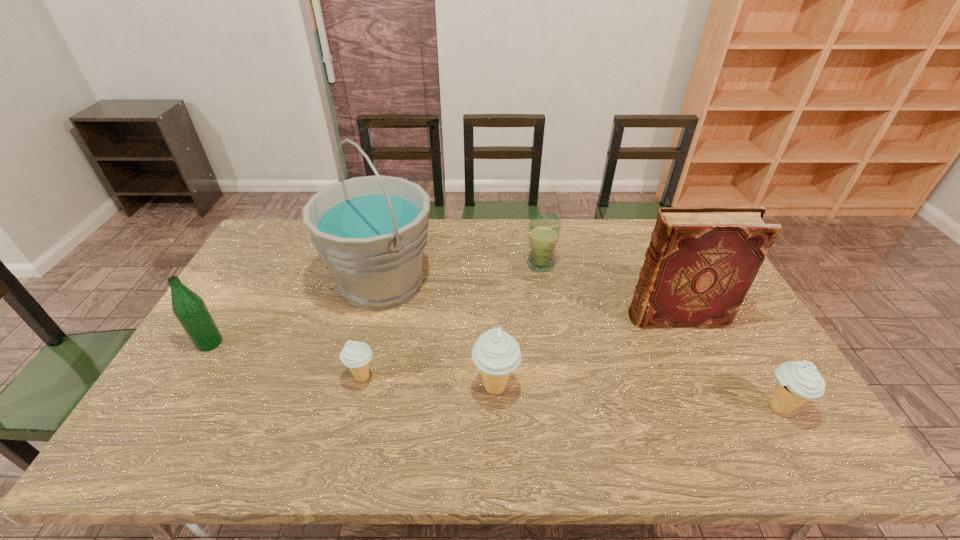
I want to click on the shortest object, so click(x=356, y=355).

Find the location of a particular element. The width and height of the screenshot is (960, 540). the leftmost icecream is located at coordinates (356, 355).

The height and width of the screenshot is (540, 960). Identify the location of the tallest icecream. (496, 353).

I want to click on the fourth object from right to left, so click(x=496, y=353).

This screenshot has height=540, width=960. In order to click on the rightmost icecream in this screenshot , I will do `click(798, 381)`.

Find the location of a particular element. This screenshot has height=540, width=960. the third object from right to left is located at coordinates (544, 228).

Where is `the tallest object`? This screenshot has height=540, width=960. the tallest object is located at coordinates (371, 231).

You are a GUI agent. You are given a task and a screenshot of the screen. Output one action in this format:
    pyautogui.click(x=<x>, y=<y>)
    Task: Click on the leftmost object
    
    Given the screenshot: What is the action you would take?
    pyautogui.click(x=189, y=308)

Locate an element on the screen. bottle is located at coordinates (189, 308).

Where is `hardback book`? This screenshot has height=540, width=960. hardback book is located at coordinates (701, 261).